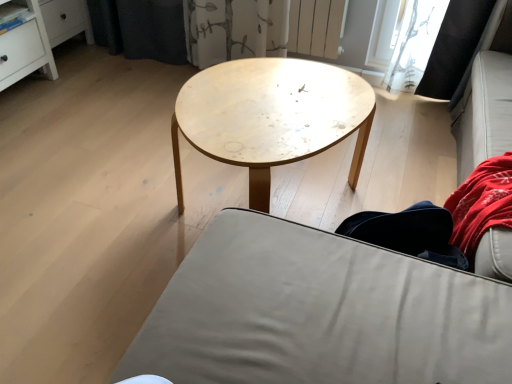
Where is `blank space situated above natural wood coffee table at center (from a real-world perspective)`? Image resolution: width=512 pixels, height=384 pixels. blank space situated above natural wood coffee table at center (from a real-world perspective) is located at coordinates (268, 100).